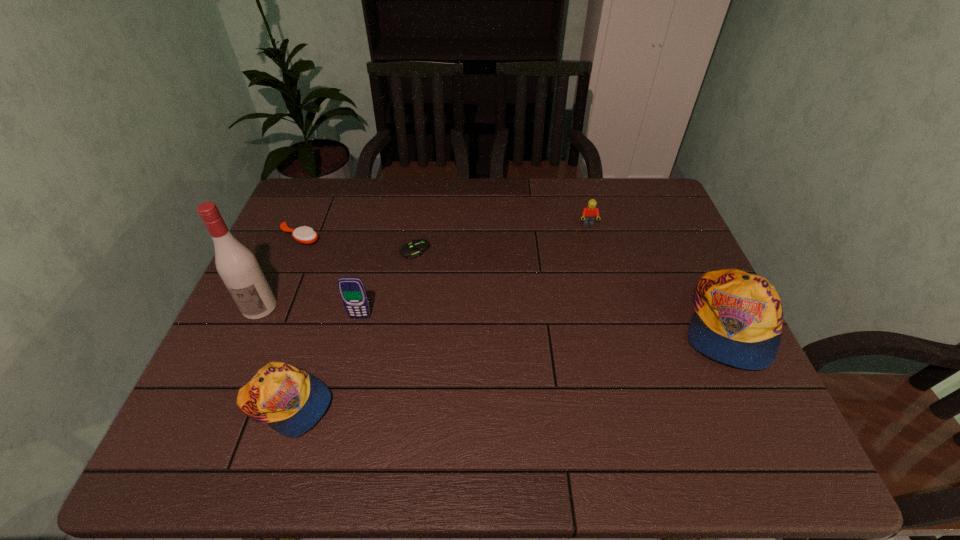
This screenshot has width=960, height=540. Find the location of `object that ranks as the second closest to the taller cap`. object that ranks as the second closest to the taller cap is located at coordinates (417, 247).

Locate an element on the screen. This screenshot has height=540, width=960. free space that satisfies the following two spatial constraints: 1. on the face of the Lego; 2. on the bill of the left cap is located at coordinates (636, 403).

I want to click on free space that satisfies the following two spatial constraints: 1. on the face of the Lego; 2. on the bill of the shorter cap, so (x=636, y=403).

The width and height of the screenshot is (960, 540). I want to click on free space that satisfies the following two spatial constraints: 1. on the face of the Lego; 2. on the bill of the shorter cap, so click(636, 403).

At what (x,y) coordinates should I click in order to perform the action: click on free location that satisfies the following two spatial constraints: 1. on the front-facing side of the cellular telephone; 2. on the bill of the shorter cap. Please return your answer as a coordinate pair (x, y). The width and height of the screenshot is (960, 540). Looking at the image, I should click on (339, 403).

Identify the location of free location that satisfies the following two spatial constraints: 1. on the front-facing side of the cellular telephone; 2. on the bill of the left cap. (339, 403).